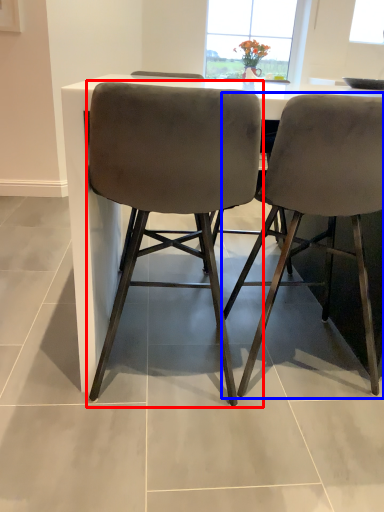
Question: Which point is closer to the camera, chair (highlighted by a red box) or chair (highlighted by a blue box)?

Choices:
 (A) chair
 (B) chair

Answer: (A)